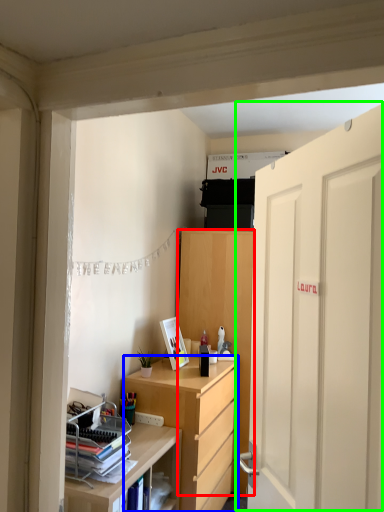
Question: Which object is positioned farthest from cabinetry (highlighted by a red box)? Select from desk (highlighted by a blue box) and door (highlighted by a green box).

Choices:
 (A) desk
 (B) door

Answer: (B)